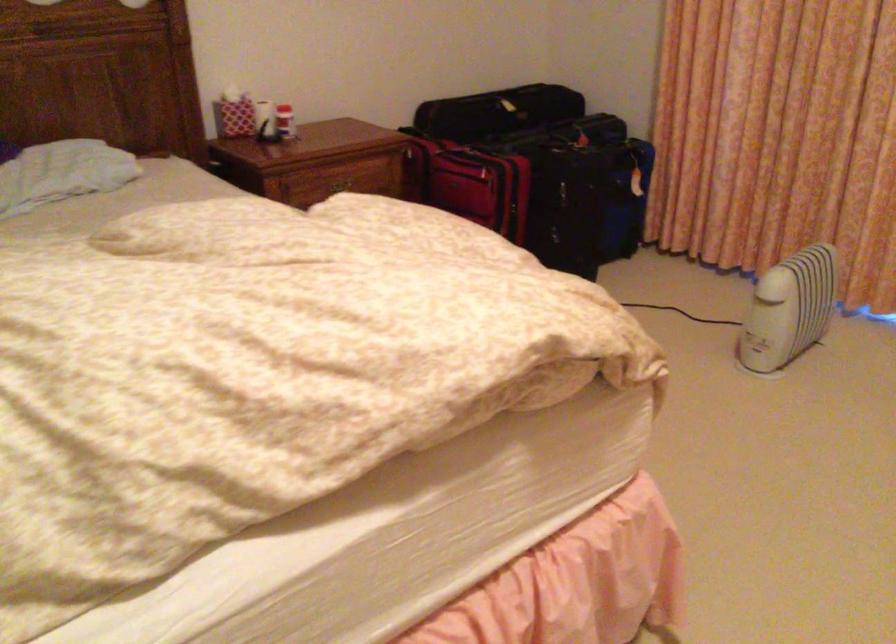
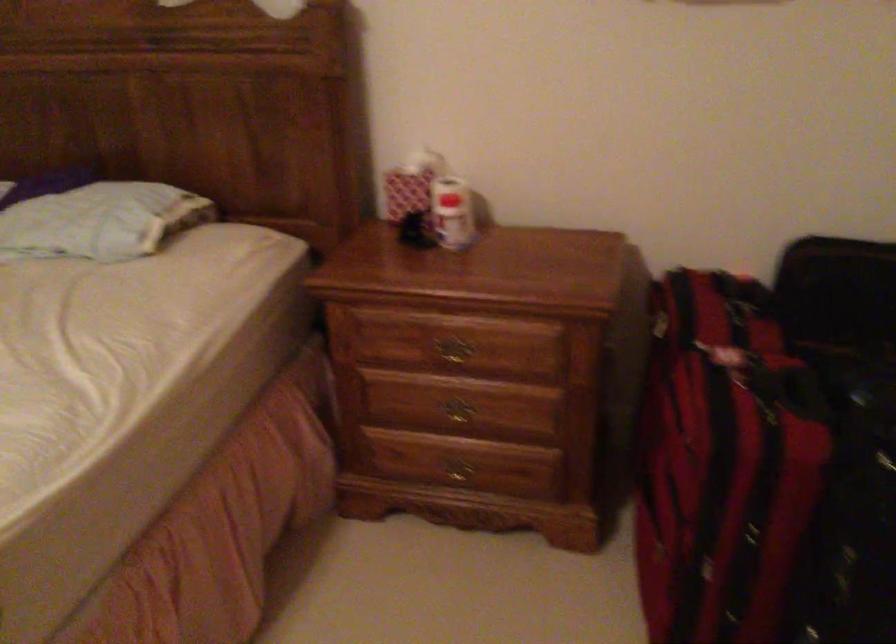
Locate, in the second image, the point that corresponds to [286,118] in the first image.

(452, 213)